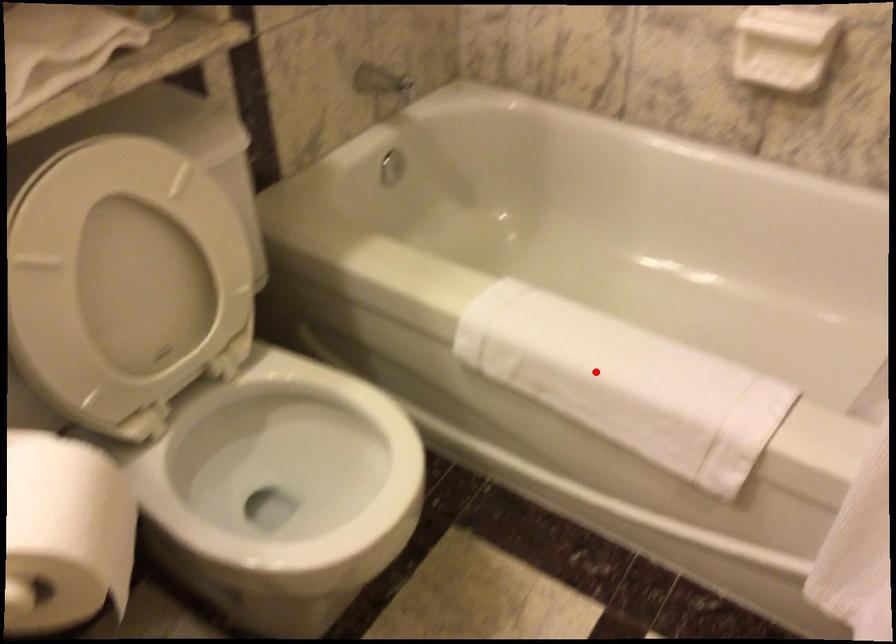
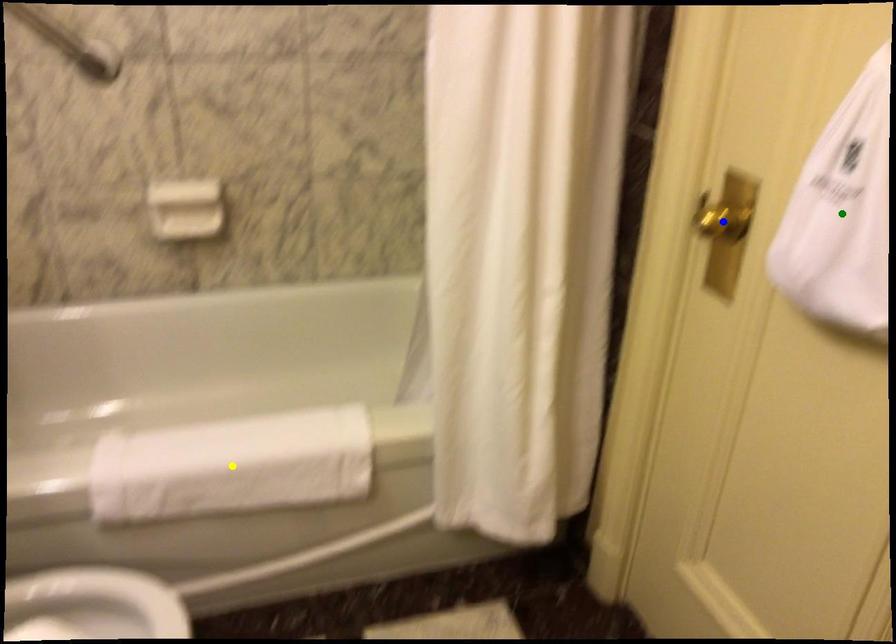
Question: I am providing you with two images of the same scene from different viewpoints. A red point is marked on the first image. You are given multiple points on the second image. Can you choose the point in image 2 that corresponds to the point in image 1?

Choices:
 (A) blue point
 (B) green point
 (C) yellow point

Answer: (C)